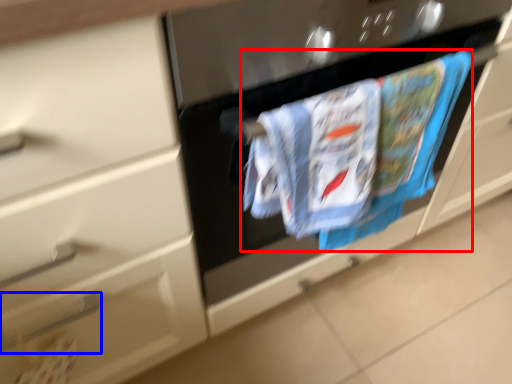
Question: Which object appears closest to the camera in this image, laundry (highlighted by a red box) or door handle (highlighted by a blue box)?

Choices:
 (A) laundry
 (B) door handle

Answer: (A)